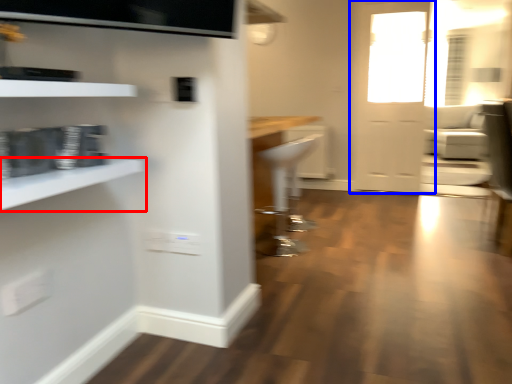
Question: Which point is further to the camera, shelf (highlighted by a red box) or door (highlighted by a blue box)?

Choices:
 (A) shelf
 (B) door

Answer: (B)